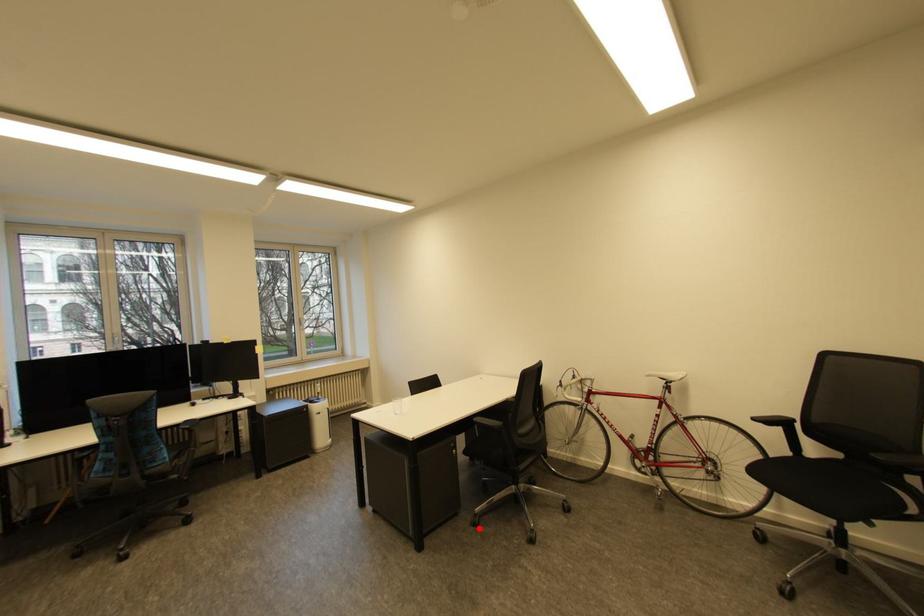
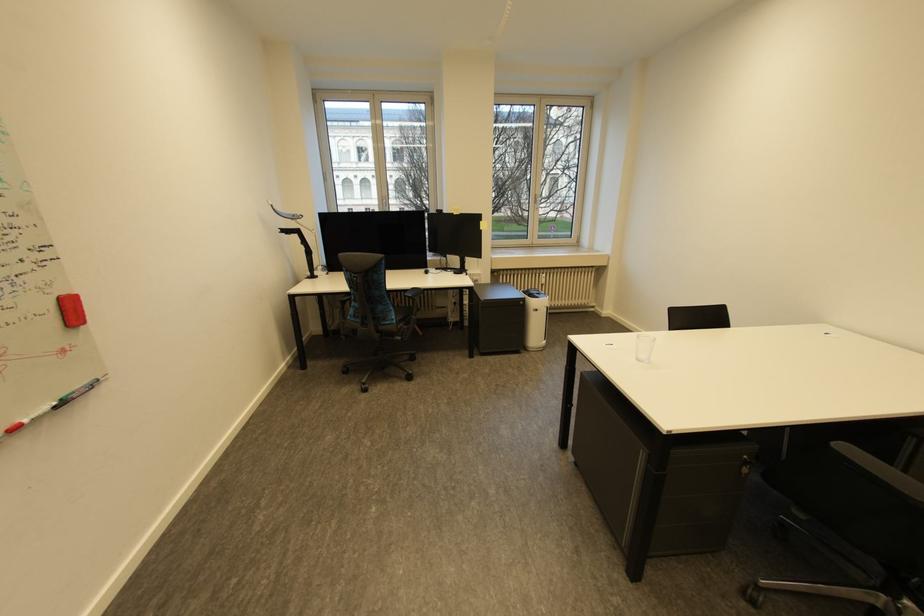
Find the pixel in the second image that matches the highlighted location in the first image.

(750, 604)